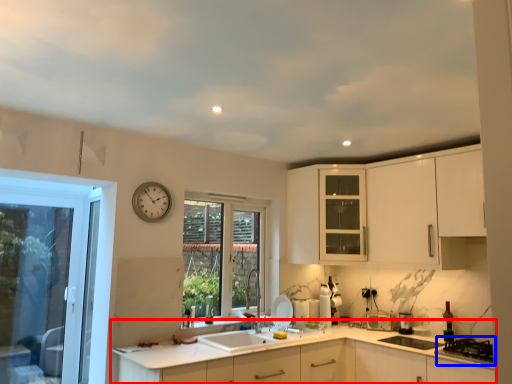
Question: Which of the following is the farthest to the observer, countertop (highlighted by a red box) or gas stove (highlighted by a blue box)?

Choices:
 (A) countertop
 (B) gas stove

Answer: (B)